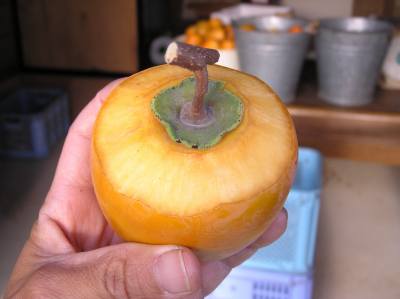
Identify the location of floor. (355, 250).